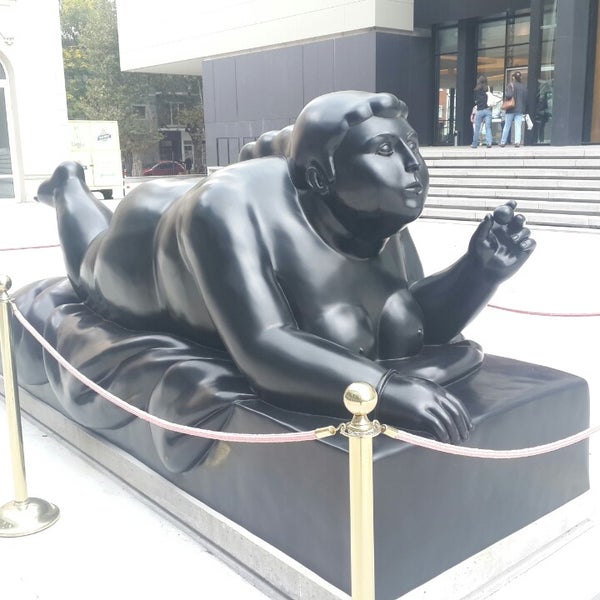
Where is `stairs`? This screenshot has width=600, height=600. stairs is located at coordinates coord(573,208).